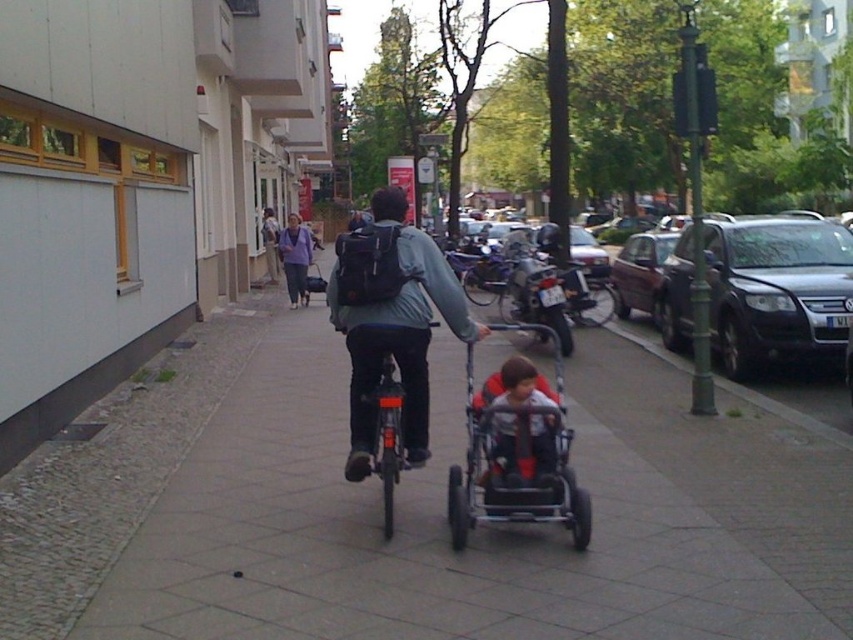
This screenshot has height=640, width=853. In order to click on gray concrete sidewalk at center in this screenshot , I will do `click(486, 528)`.

What do you see at coordinates (486, 528) in the screenshot? I see `gray concrete sidewalk at center` at bounding box center [486, 528].

This screenshot has height=640, width=853. Identify the location of gray concrete sidewalk at center. (486, 528).

Between point (837, 348) and point (641, 296), which one is positioned behind?

Positioned behind is point (641, 296).

Which is below, dark gray metallic suv at right or metallic maroon sedan at center-right?

Positioned lower is dark gray metallic suv at right.

At what (x,y) coordinates should I click in order to perform the action: click on dark gray metallic suv at right. Please return your answer as a coordinate pair (x, y). Looking at the image, I should click on (776, 289).

You are a GUI agent. You are given a task and a screenshot of the screen. Output one action in this format:
    pyautogui.click(x=<x>, y=<y>)
    Task: Click on the dark gray metallic suv at right
    Image resolution: width=853 pixels, height=640 pixels.
    Given the screenshot: What is the action you would take?
    pyautogui.click(x=776, y=289)

Which of these two, gray concrete sidewalk at center or dark gray plastic stroller at center, stands shorter?

With less height is gray concrete sidewalk at center.

How much distance is there between gray concrete sidewalk at center and dark gray plastic stroller at center?

The distance of gray concrete sidewalk at center from dark gray plastic stroller at center is 10.53 feet.

Where is `gray concrete sidewalk at center`? This screenshot has width=853, height=640. gray concrete sidewalk at center is located at coordinates (486, 528).

What are the coordinates of `gray concrete sidewalk at center` in the screenshot? It's located at (486, 528).